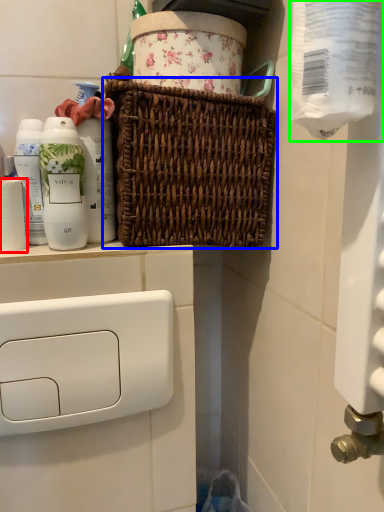
Question: Considering the real-world distances, which object is farthest from toilet paper (highlighted by a red box)? picnic basket (highlighted by a blue box) or toilet paper (highlighted by a green box)?

Choices:
 (A) picnic basket
 (B) toilet paper

Answer: (B)